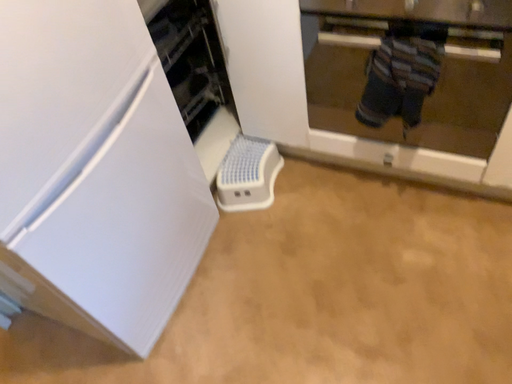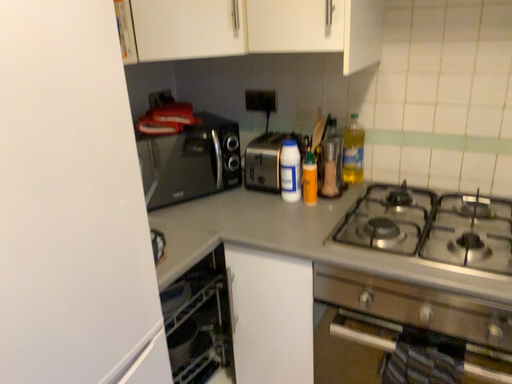
Question: How did the camera likely rotate when shooting the video?

Choices:
 (A) rotated downward
 (B) rotated upward

Answer: (B)